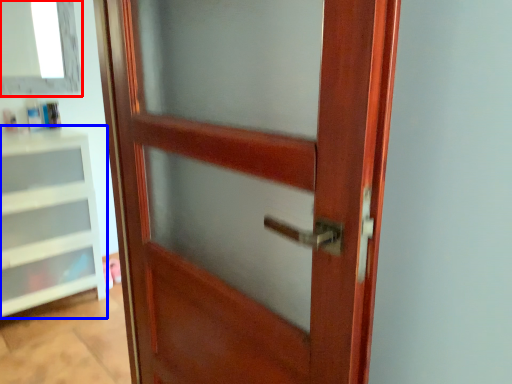
Question: Among these objects, which one is nearest to the camera, window (highlighted by a red box) or shelf (highlighted by a blue box)?

Choices:
 (A) window
 (B) shelf

Answer: (B)